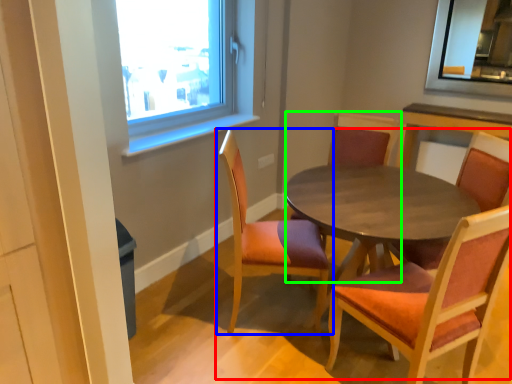
Question: Which object is positioned farthest from kitchen & dining room table (highlighted by a red box)? Select from chair (highlighted by a blue box) and chair (highlighted by a green box).

Choices:
 (A) chair
 (B) chair

Answer: (B)